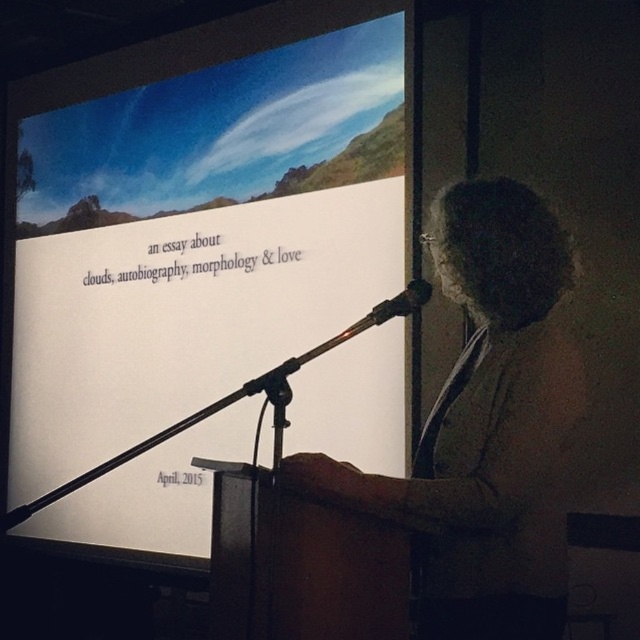
Does gray fabric at center have a greater height compared to black metallic microphone at center?

Yes.

Which is more to the left, gray fabric at center or black metallic microphone at center?

Positioned to the left is black metallic microphone at center.

Locate an element on the screen. This screenshot has height=640, width=640. gray fabric at center is located at coordinates (484, 428).

Where is `gray fabric at center`? This screenshot has width=640, height=640. gray fabric at center is located at coordinates (484, 428).

Can you confirm if white paper at upper center is taller than gray fabric at center?

Yes, white paper at upper center is taller than gray fabric at center.

Locate an element on the screen. This screenshot has width=640, height=640. white paper at upper center is located at coordinates (200, 230).

Between white paper at upper center and black metallic microphone at center, which one appears on the left side from the viewer's perspective?

From the viewer's perspective, white paper at upper center appears more on the left side.

What do you see at coordinates (200, 230) in the screenshot? The image size is (640, 640). I see `white paper at upper center` at bounding box center [200, 230].

At what (x,y) coordinates should I click in order to perform the action: click on white paper at upper center. Please return your answer as a coordinate pair (x, y). This screenshot has height=640, width=640. Looking at the image, I should click on (200, 230).